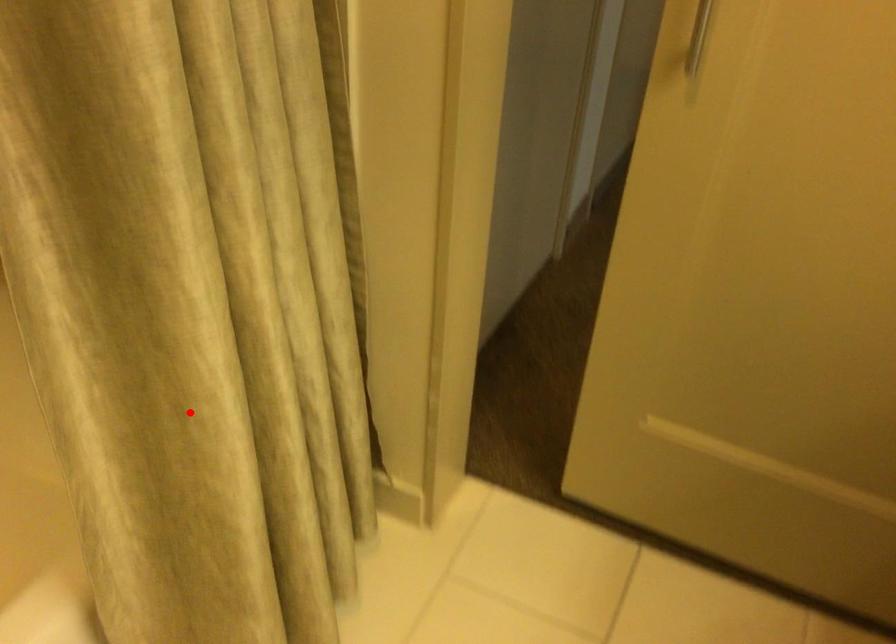
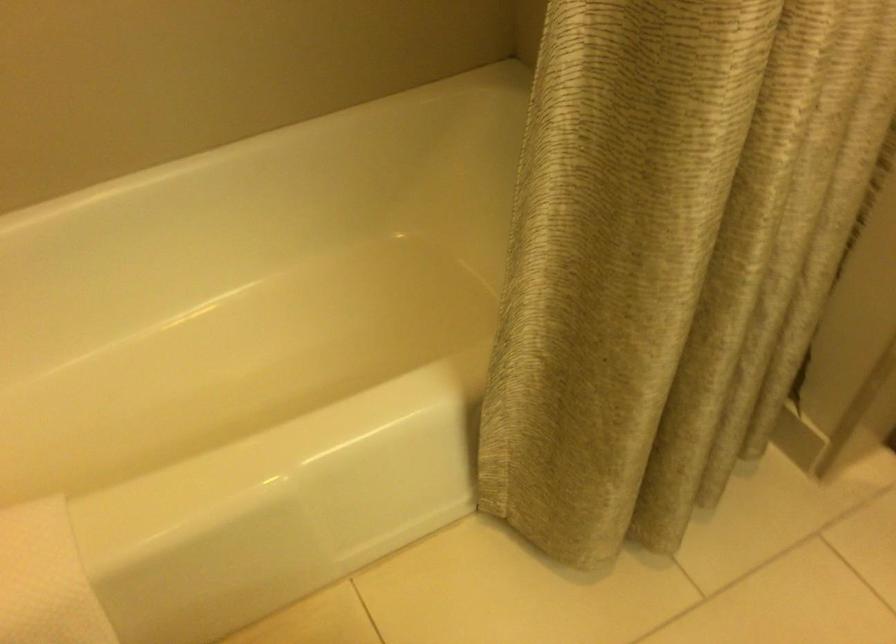
Locate, in the second image, the point that corresponds to the highlighted location in the first image.

(643, 254)